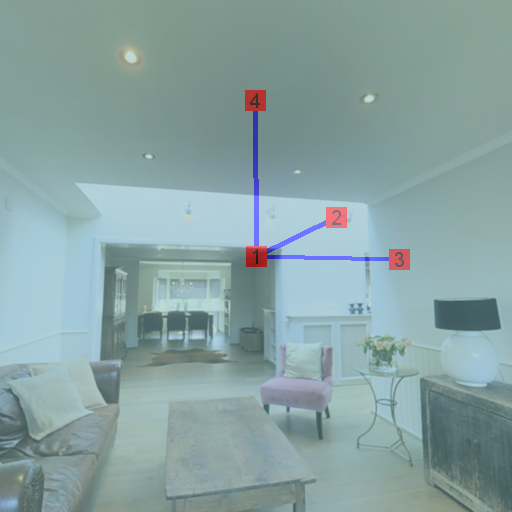
At what (x,y) coordinates should I click in order to perform the action: click on end table. Please return your answer as a coordinate pair (x, y). Image resolution: width=512 pixels, height=512 pixels. Looking at the image, I should click on (398, 366).